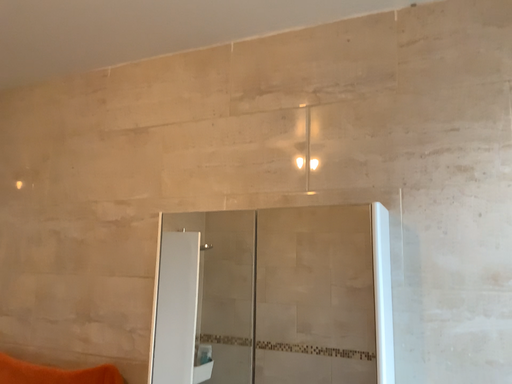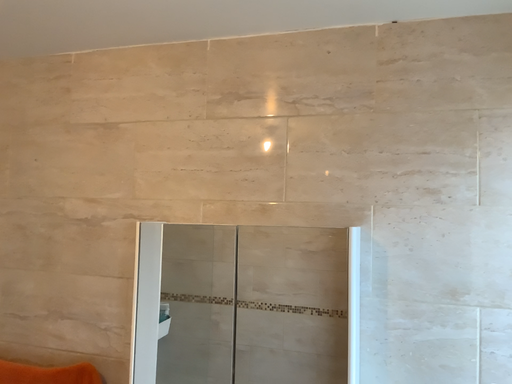
Question: How did the camera likely rotate when shooting the video?

Choices:
 (A) rotated left
 (B) rotated right

Answer: (B)